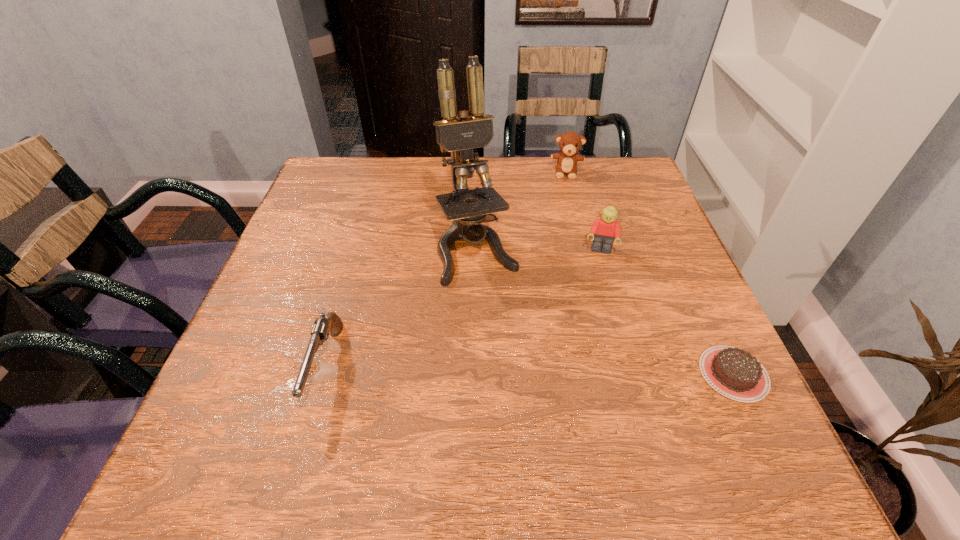
Find the location of `vacant space situated at the eyepieces of the second object from left to right`. vacant space situated at the eyepieces of the second object from left to right is located at coordinates (529, 379).

Identify the location of vacant space located at the eyepieces of the second object from left to right. The height and width of the screenshot is (540, 960). (535, 393).

Where is `vacant region located on the face of the farthest object`? This screenshot has width=960, height=540. vacant region located on the face of the farthest object is located at coordinates (561, 277).

The width and height of the screenshot is (960, 540). I want to click on vacant area situated on the face of the farthest object, so [x=561, y=274].

This screenshot has height=540, width=960. Identify the location of vacant space located on the face of the farthest object. click(564, 219).

You are a GUI agent. You are given a task and a screenshot of the screen. Output one action in this format:
    pyautogui.click(x=<x>, y=<y>)
    Task: Click on the free point located on the face of the Lego
    This screenshot has height=540, width=960.
    Given the screenshot: What is the action you would take?
    pyautogui.click(x=580, y=406)

You are a GUI agent. You are given a task and a screenshot of the screen. Output one action in this format:
    pyautogui.click(x=<x>, y=<y>)
    Task: Click on the free region located on the face of the Lego
    
    Given the screenshot: What is the action you would take?
    pyautogui.click(x=588, y=341)

I want to click on free space located on the face of the Lego, so click(591, 310).

Find the location of a particular element. The image size is (960, 540). object at the far edge is located at coordinates (570, 142).

Locate an element on the screen. gun present at the near edge is located at coordinates (320, 332).